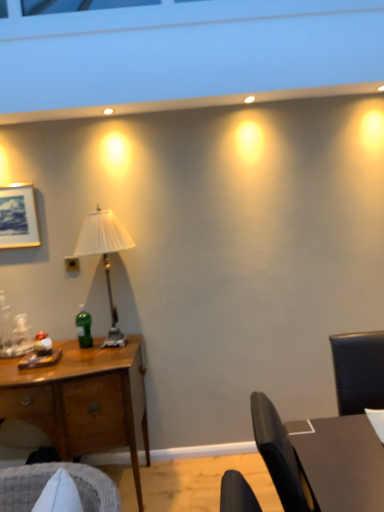
The image size is (384, 512). Find the location of `free spot above wooden desk at left (from a real-world perspective)`. free spot above wooden desk at left (from a real-world perspective) is located at coordinates (58, 359).